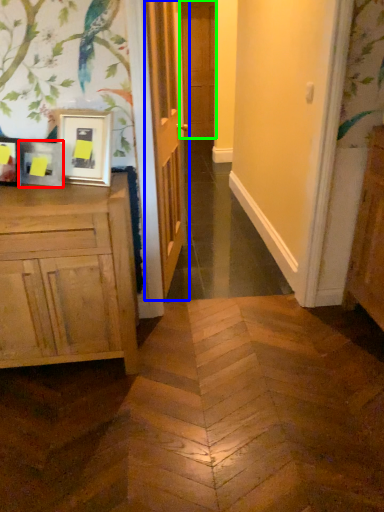
Question: Which is farther away from picture frame (highlighted by a red box)? door (highlighted by a blue box) or door (highlighted by a green box)?

Choices:
 (A) door
 (B) door

Answer: (B)